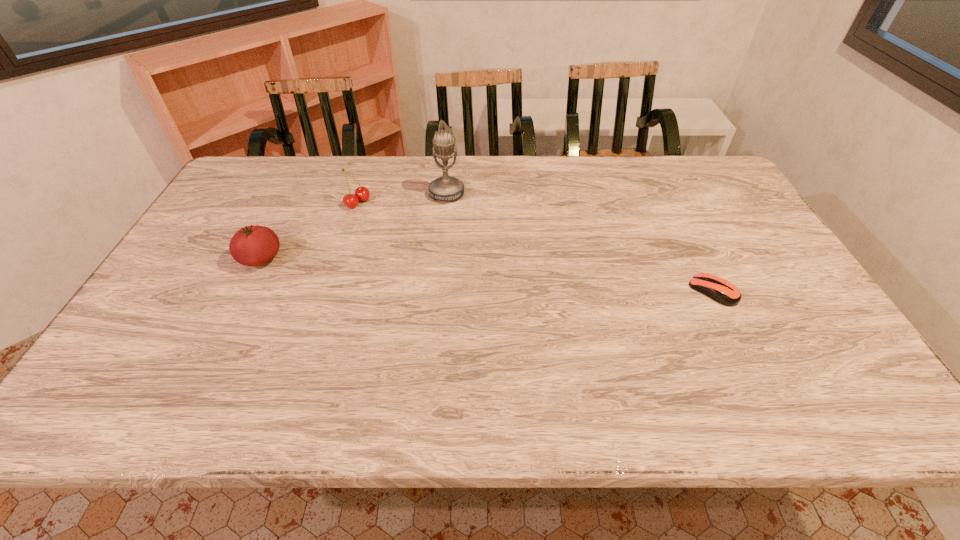
At what (x,y) coordinates should I click in order to perform the action: click on tomato. Please return your answer as a coordinate pair (x, y). Looking at the image, I should click on (254, 245).

The image size is (960, 540). What are the coordinates of `the leftmost object` in the screenshot? It's located at (254, 245).

At what (x,y) coordinates should I click in order to perform the action: click on computer mouse. Please return your answer as a coordinate pair (x, y). The height and width of the screenshot is (540, 960). Looking at the image, I should click on pyautogui.click(x=722, y=291).

Identify the location of the shortest object. (722, 291).

Locate an element on the screen. This screenshot has height=540, width=960. the third object from left to right is located at coordinates (445, 188).

The image size is (960, 540). Find the location of `the tallest object`. the tallest object is located at coordinates (445, 188).

The width and height of the screenshot is (960, 540). I want to click on the second object from left to right, so click(361, 193).

The height and width of the screenshot is (540, 960). Identify the location of vacant area situated on the right of the leftmost object. (419, 259).

This screenshot has height=540, width=960. I want to click on free space located on the back of the nearest object, so click(674, 212).

Identify the location of vacant space located 0.080m on the front-facing side of the second object from right to left. This screenshot has width=960, height=540. (436, 220).